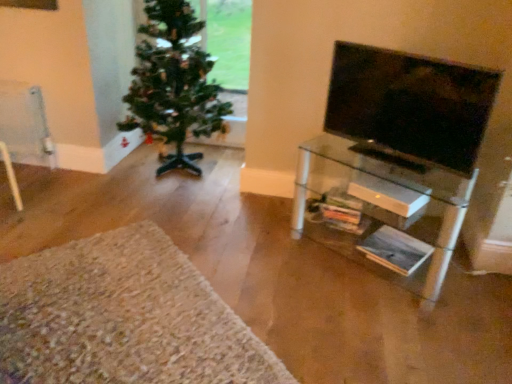
You are a GUI agent. You are given a task and a screenshot of the screen. Output one action in this format:
    pyautogui.click(x=<x>, y=<y>)
    Task: Click on the free space to the back side of white shaggy rug at lower left
    This screenshot has height=384, width=512.
    Given the screenshot: What is the action you would take?
    pyautogui.click(x=165, y=206)